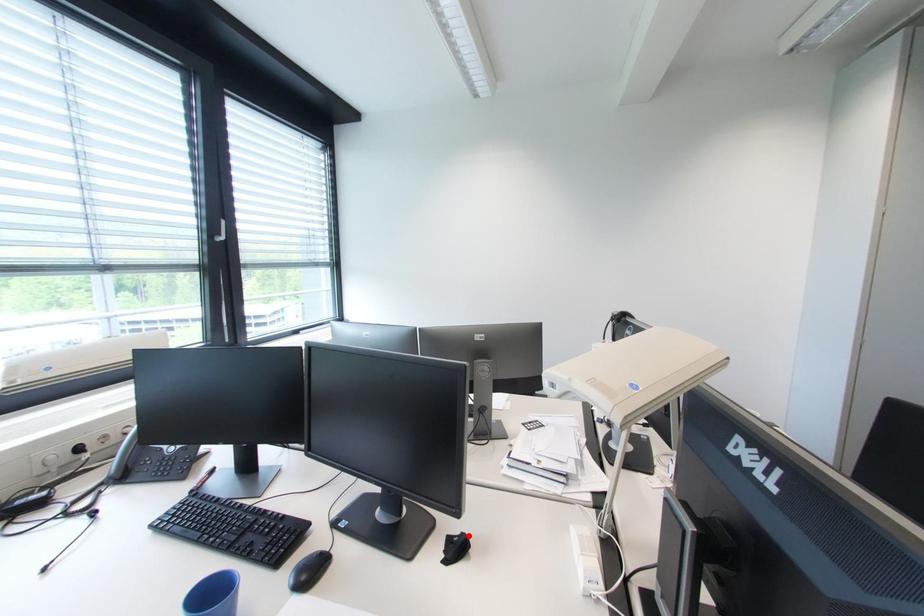
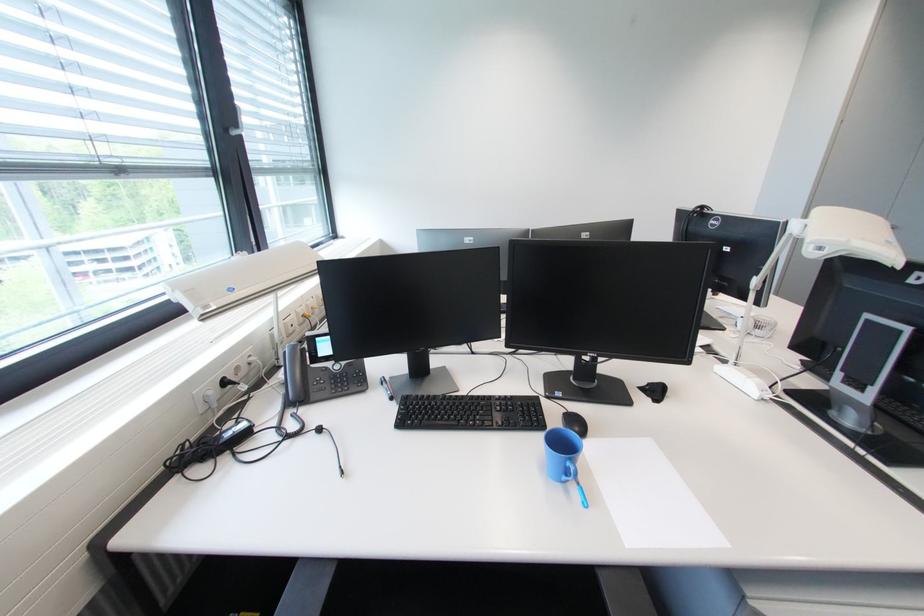
Question: I am providing you with two images of the same scene from different viewpoints. Given a red point in image1, look at the same physical point in image2. Is it:

Choices:
 (A) Closer to the viewpoint
 (B) Farther from the viewpoint

Answer: (A)